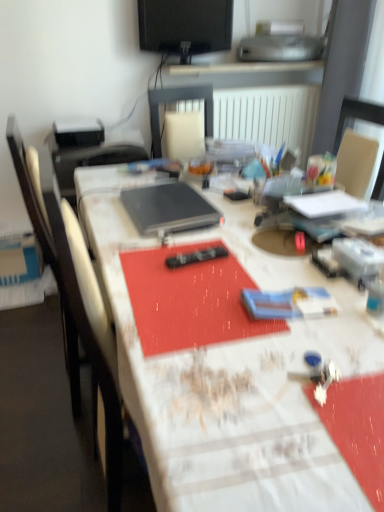
I want to click on vacant point to the left of black matte laptop at center, so click(x=103, y=209).